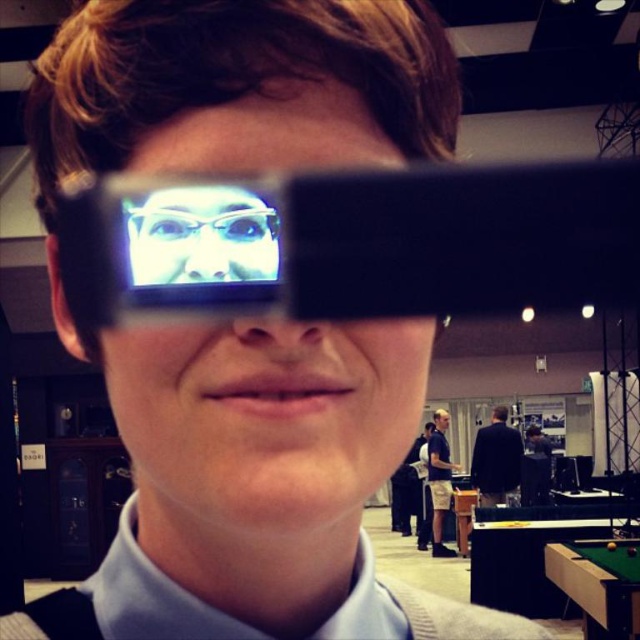
In the scene shown: Does green felt billiard table at lower right have a greater width compared to clear plastic glasses at center?

Yes, green felt billiard table at lower right is wider than clear plastic glasses at center.

Who is more forward, (563,547) or (244,221)?

Point (244,221)

The height and width of the screenshot is (640, 640). Find the location of `green felt billiard table at lower right`. green felt billiard table at lower right is located at coordinates (595, 592).

Between black glossy pool table at lower right and clear plastic glasses at center, which one appears on the left side from the viewer's perspective?

Positioned to the left is clear plastic glasses at center.

The height and width of the screenshot is (640, 640). In order to click on black glossy pool table at lower right in this screenshot , I will do `click(528, 554)`.

Locate an element on the screen. black glossy pool table at lower right is located at coordinates (528, 554).

Between black glossy pool table at lower right and blue glossy eye at center, which one is positioned higher?

Positioned higher is blue glossy eye at center.

Is black glossy pool table at lower right to the right of blue glossy eye at center from the viewer's perspective?

Yes, black glossy pool table at lower right is to the right of blue glossy eye at center.

I want to click on black glossy pool table at lower right, so click(x=528, y=554).